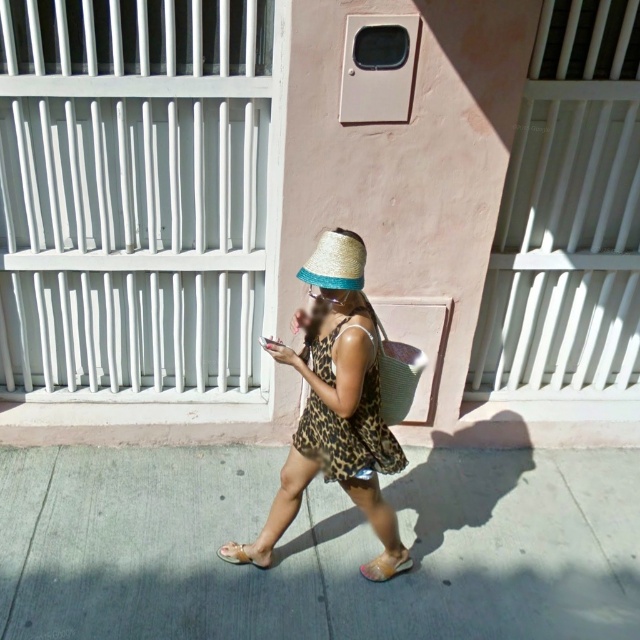
Which is in front, point (310, 352) or point (396, 557)?

Point (310, 352) is in front.

Measure the distance between point (x=333, y=467) and camera.

Point (x=333, y=467) and camera are 2.68 meters apart.

Locate an element on the screen. This screenshot has height=640, width=640. leopard print fabric dress at center is located at coordinates (349, 435).

Is gray concrete sidewalk at center positioned at the back of leopard print fabric dress at center?

Yes, gray concrete sidewalk at center is further from the viewer.

Who is higher up, gray concrete sidewalk at center or leopard print fabric dress at center?

Positioned higher is leopard print fabric dress at center.

Who is more forward, (509,497) or (368,408)?

Point (368,408) is more forward.

The height and width of the screenshot is (640, 640). I want to click on gray concrete sidewalk at center, so click(316, 547).

Does gray concrete sidewalk at center have a greater width compared to straw at center?

Correct, the width of gray concrete sidewalk at center exceeds that of straw at center.

Is point (72, 484) positioned in front of point (344, 284)?

No, (72, 484) is behind (344, 284).

Between point (380, 625) and point (308, 282), which one is positioned in front?

Point (308, 282)

This screenshot has width=640, height=640. I want to click on gray concrete sidewalk at center, so tap(316, 547).